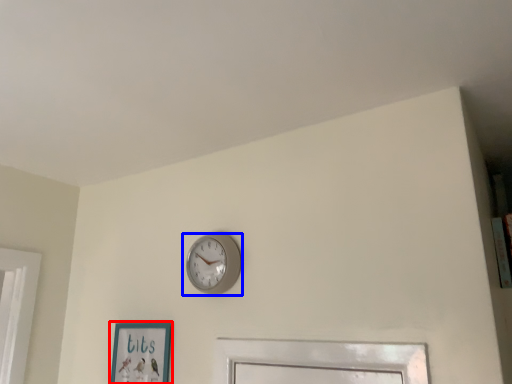
Question: Which of the following is the farthest to the observer, picture frame (highlighted by a red box) or wall clock (highlighted by a blue box)?

Choices:
 (A) picture frame
 (B) wall clock

Answer: (A)